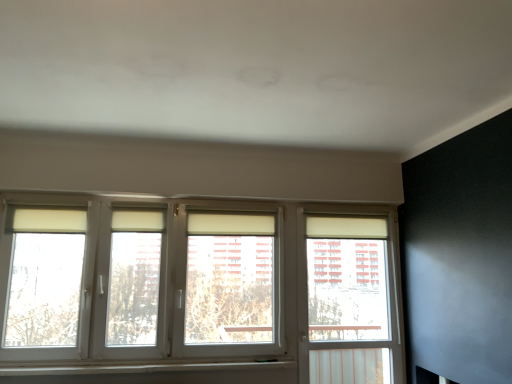
Question: Is white plastic window at right wider or thinner than white plastic window sill at lower center?

Choices:
 (A) thin
 (B) wide

Answer: (A)

Question: In terms of size, does white plastic window at right appear bigger or smaller than white plastic window sill at lower center?

Choices:
 (A) small
 (B) big

Answer: (B)

Question: Estimate the real-world distances between objects in this image. Which object is farther from the white plastic window at center?

Choices:
 (A) white plastic window sill at lower center
 (B) white plastic window at right

Answer: (A)

Question: Which object is positioned farthest from the white plastic window at center?

Choices:
 (A) white plastic window sill at lower center
 (B) white plastic window at right

Answer: (A)